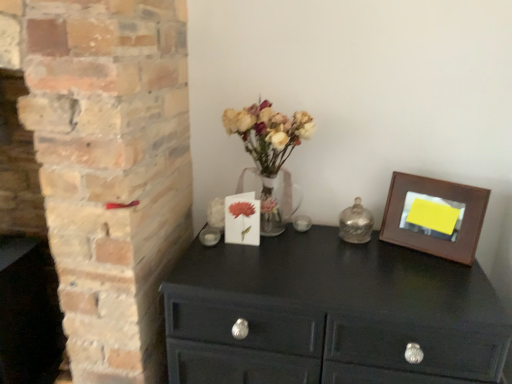
What are the coordinates of `free space on the front side of brown wooden picture frame at upper right` in the screenshot? It's located at (458, 274).